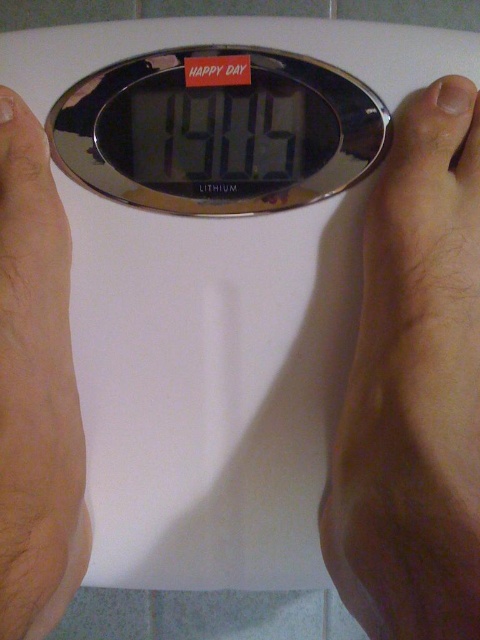
Which is above, dry skin at right or skinny flesh at left?

dry skin at right

The width and height of the screenshot is (480, 640). Describe the element at coordinates (415, 387) in the screenshot. I see `dry skin at right` at that location.

I want to click on dry skin at right, so click(415, 387).